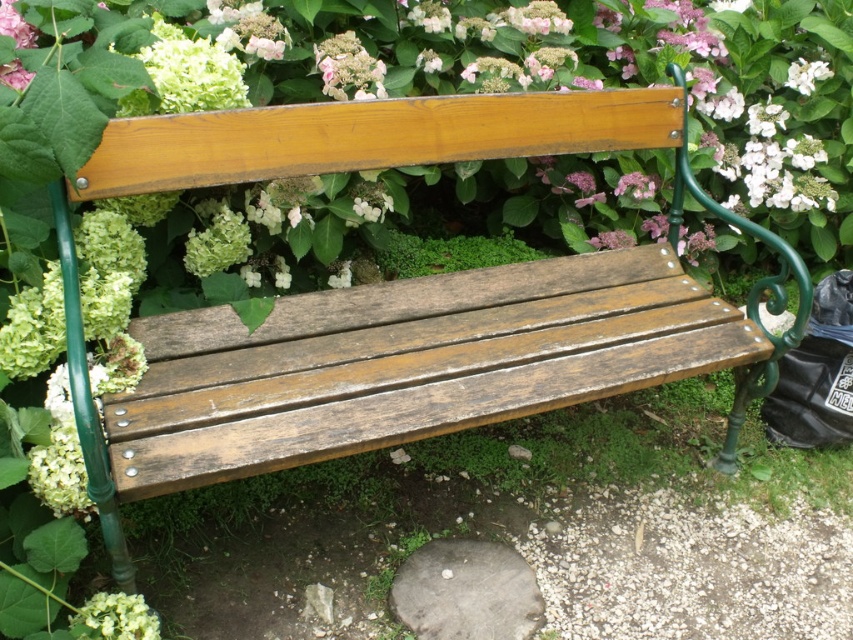
Looking at this image, does green mossy bush at center appear under pink matte hydrangea at upper center?

Yes.

Can you confirm if green mossy bush at center is positioned to the left of pink matte hydrangea at upper center?

In fact, green mossy bush at center is to the right of pink matte hydrangea at upper center.

The image size is (853, 640). What do you see at coordinates (448, 253) in the screenshot? I see `green mossy bush at center` at bounding box center [448, 253].

Image resolution: width=853 pixels, height=640 pixels. Find the location of `green mossy bush at center`. green mossy bush at center is located at coordinates (448, 253).

Between white matte flower at lower left and pink matte flower at upper center, which one appears on the right side from the viewer's perspective?

pink matte flower at upper center

Consider the image. Does white matte flower at lower left have a larger size compared to pink matte flower at upper center?

Indeed, white matte flower at lower left has a larger size compared to pink matte flower at upper center.

Find the location of a particular element. Image resolution: width=853 pixels, height=640 pixels. white matte flower at lower left is located at coordinates 114,618.

You are a GUI agent. You are given a task and a screenshot of the screen. Output one action in this format:
    pyautogui.click(x=<x>, y=<y>)
    Task: Click on the white matte flower at lower left
    The height and width of the screenshot is (640, 853).
    Given the screenshot: What is the action you would take?
    pyautogui.click(x=114, y=618)

Who is lower down, white fluffy flower at upper left or white matte flower at upper center?

white fluffy flower at upper left is below.

Find the location of a particular element. This screenshot has width=853, height=640. white fluffy flower at upper left is located at coordinates (15, 26).

Identify the location of white fluffy flower at upper left. (15, 26).